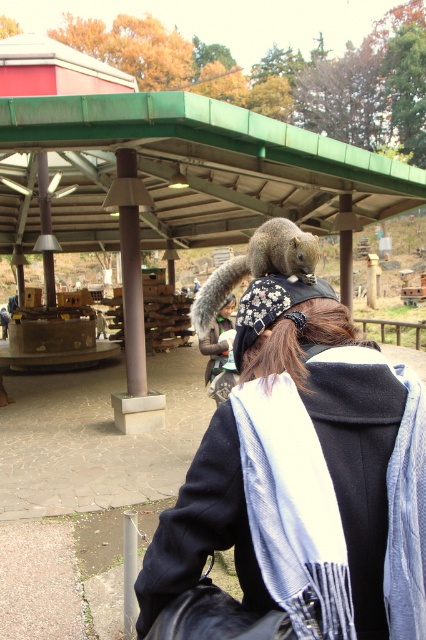
Measure the distance from black woolen scarf at upper center to gray furry squirrel on the shoulder.

57.98 centimeters

Between black woolen scarf at upper center and gray furry squirrel on the shoulder, which one is positioned higher?

gray furry squirrel on the shoulder is above.

Between point (408, 468) and point (298, 230), which one is positioned behind?

Positioned behind is point (298, 230).

Image resolution: width=426 pixels, height=640 pixels. Find the location of `black woolen scarf at upper center`. black woolen scarf at upper center is located at coordinates click(x=305, y=477).